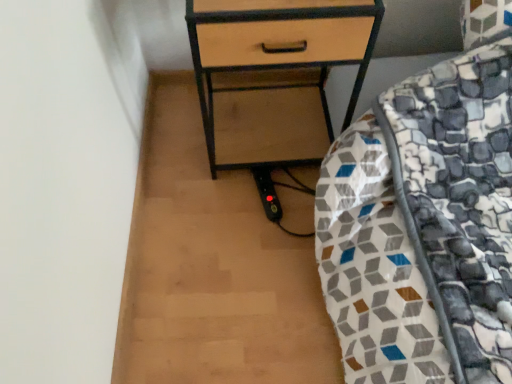
Find the location of a particular element. free location to the left of woodenmaterial/texturechest of drawers at upper center is located at coordinates (177, 142).